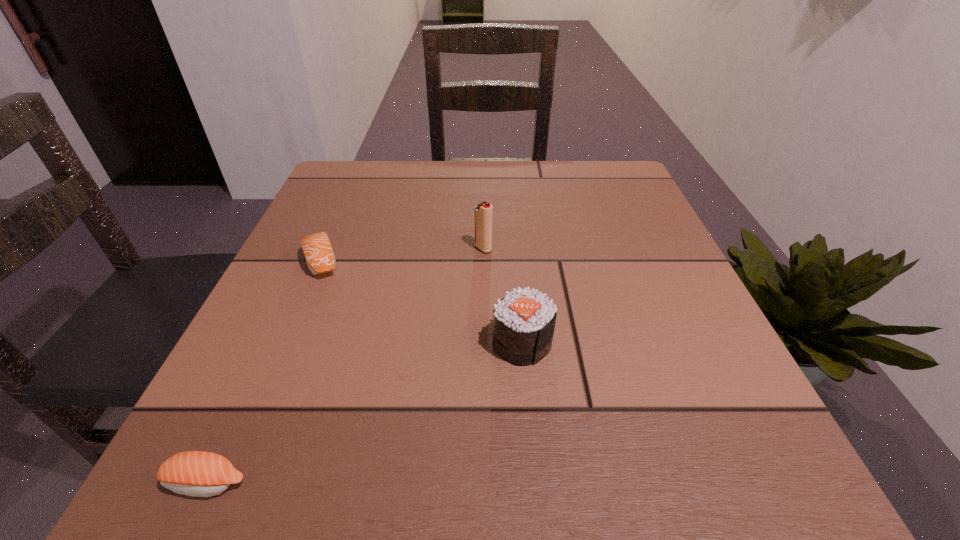
Where is `object present at the near left corner`? object present at the near left corner is located at coordinates (194, 473).

Where is `vacant space at the far edge`? Image resolution: width=960 pixels, height=540 pixels. vacant space at the far edge is located at coordinates (469, 164).

I want to click on vacant space at the near edge of the desktop, so click(x=331, y=475).

Where is `vacant area at the left edge of the desktop`? Image resolution: width=960 pixels, height=540 pixels. vacant area at the left edge of the desktop is located at coordinates (227, 404).

Identify the location of free space at the right edge of the desktop. This screenshot has width=960, height=540. (592, 252).

This screenshot has width=960, height=540. In the image, there is a desktop. Find the location of `vacant region at the far left corner`. vacant region at the far left corner is located at coordinates tap(352, 165).

The image size is (960, 540). In the image, there is a desktop. In order to click on vacant area at the near right corner in this screenshot , I will do `click(680, 441)`.

Locate an element on the screen. Image resolution: width=960 pixels, height=540 pixels. vacant area that lies between the rightmost sushi and the igniter is located at coordinates (503, 296).

Identify the location of vacant area that lies between the nearest object and the second nearest sushi. The height and width of the screenshot is (540, 960). (365, 413).

You are a GUI agent. You are given a task and a screenshot of the screen. Output one action in this format:
    pyautogui.click(x=<x>, y=<y>)
    Task: Click on the vacant space that is in between the tallest object and the nearest object
    The width and height of the screenshot is (960, 540).
    Given the screenshot: What is the action you would take?
    pyautogui.click(x=345, y=366)